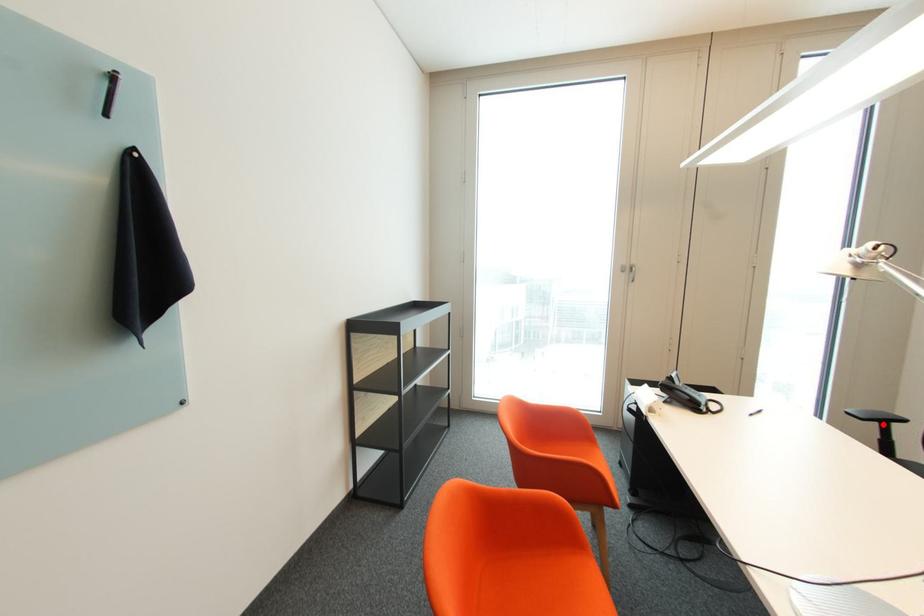
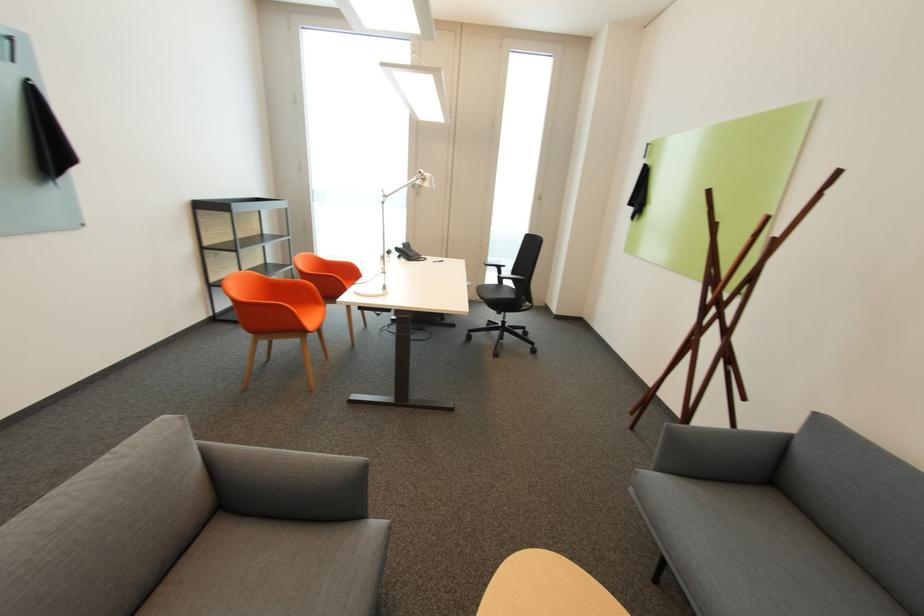
Question: I am providing you with two images of the same scene from different viewpoints. Image1 has a red point marked. In image2, the corresponding 3D location appears at what relative position? Reply with the corresponding letter.

Choices:
 (A) Closer
 (B) Farther

Answer: (A)